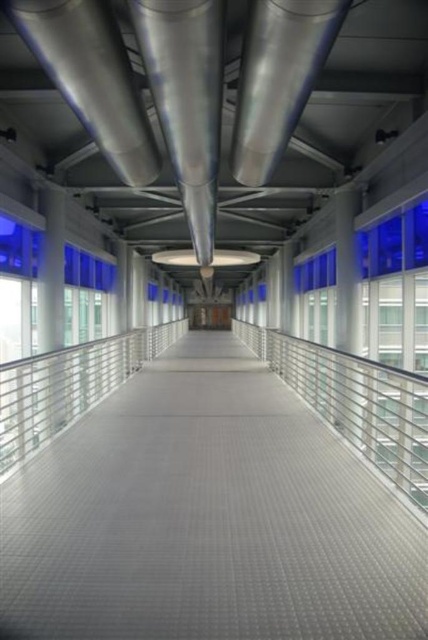
You are a delivery robot with a width of 0.8 meters. You need to navigate through the gray textured walkway at center and the silver metallic rail at center. Which path can you safely pass through without touching the sides?

The gray textured walkway at center is thinner than the silver metallic rail at center. Since the robot is 0.8 meters wide, it can safely pass through the silver metallic rail at center which is wider, but the gray textured walkway at center may be too narrow. However, the question mentions navigating through both paths, so the safest option is the silver metallic rail at center.

You are standing on the gray textured walkway at center and want to move to the white glossy pillar at left. Which direction should you face to walk towards it?

You should face left to walk towards the white glossy pillar at left since the gray textured walkway at center is to the right of it.

You are a maintenance worker needing to place a 10 feet long ladder between the gray textured walkway at center and the white glossy pillar at left. Can the ladder fit in the space between them?

The space between the gray textured walkway at center and the white glossy pillar at left is 9.73 feet. Since the ladder is 10 feet long, it cannot fit in the space between them because the ladder is longer than the available space.